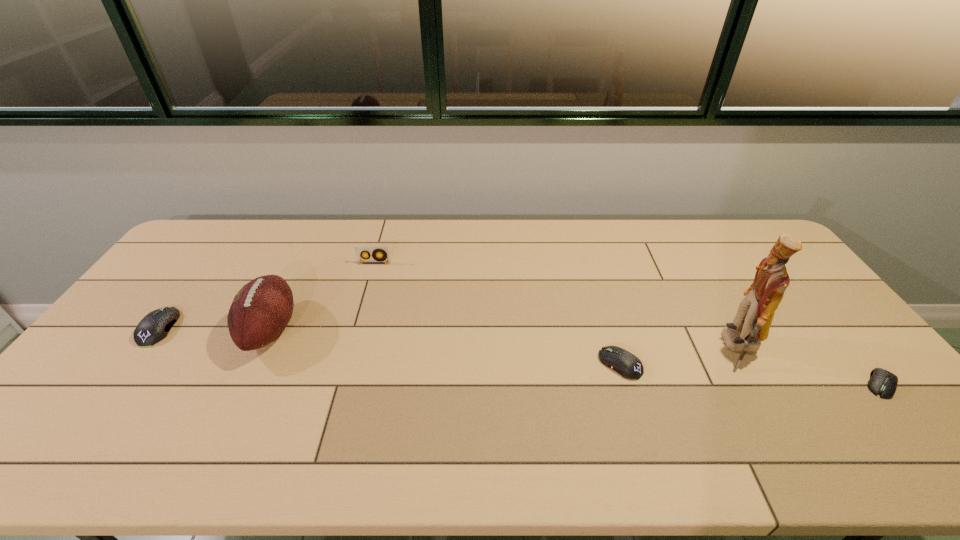
The height and width of the screenshot is (540, 960). I want to click on empty location between the videotape and the rightmost computer equipment, so click(628, 324).

At what (x,y) coordinates should I click in order to perform the action: click on vacant area between the shortest object and the leftmost object. Please return your answer as a coordinate pair (x, y). Looking at the image, I should click on (520, 356).

You are a GUI agent. You are given a task and a screenshot of the screen. Output one action in this format:
    pyautogui.click(x=<x>, y=<y>)
    Task: Click on the free spot between the fifth shortest object and the leftmost computer equipment
    The width and height of the screenshot is (960, 540).
    Given the screenshot: What is the action you would take?
    pyautogui.click(x=215, y=329)

Where is `vacant area that lies between the second tallest computer equipment and the farthest computer equipment`? The width and height of the screenshot is (960, 540). vacant area that lies between the second tallest computer equipment and the farthest computer equipment is located at coordinates (390, 346).

The image size is (960, 540). I want to click on empty location between the fifth object from left to right and the second computer equipment from left to right, so click(x=680, y=356).

The image size is (960, 540). Identify the location of empty location between the second tallest object and the farthest object. (323, 296).

Find the location of a particular element. The image size is (960, 540). free area in between the second shortest object and the shortest computer equipment is located at coordinates (751, 374).

Identify which object is the fourth closest to the leftmost computer equipment. Please provide its 2D coordinates. Your answer should be formatted as a tuple, i.e. [(x, y)], where the tuple contains the x and y coordinates of a point satisfying the conditions above.

[(751, 325)]

Locate which object is the fifth closest to the third object from right to left. Please provide its 2D coordinates. Your answer should be formatted as a tuple, i.e. [(x, y)], where the tuple contains the x and y coordinates of a point satisfying the conditions above.

[(154, 327)]

Image resolution: width=960 pixels, height=540 pixels. Identify the location of computer equipment that stands as the closest to the tallest computer equipment. (629, 366).